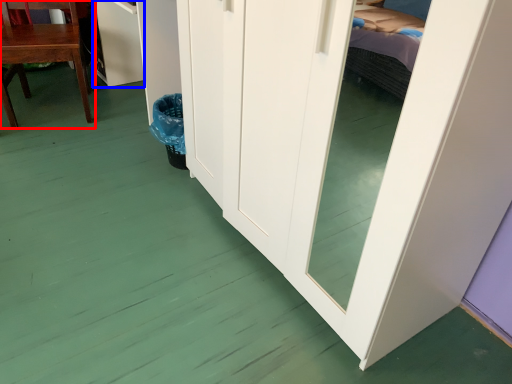
Question: Among these objects, which one is nearest to the camera, chair (highlighted by a red box) or cabinetry (highlighted by a blue box)?

Choices:
 (A) chair
 (B) cabinetry

Answer: (A)